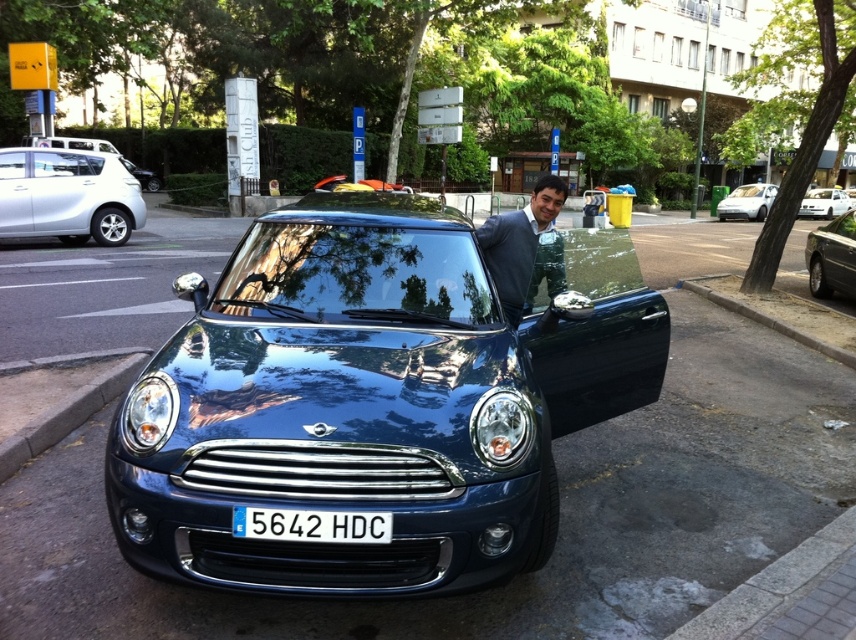
You are a parking attendant who needs to guide a driver to park their car between the metallic silver sedan at right and the metallic silver hatchback at upper left. Can you confirm if there is enough space between them for a standard compact car?

The metallic silver sedan at right is positioned on the right side of the metallic silver hatchback at upper left, so there is space between them. A standard compact car can fit between the metallic silver sedan at right and the metallic silver hatchback at upper left.

You are a delivery person who needs to place a package on the roof of the matte blue suit at center and the white plastic license plate at center. Which object requires the package to be placed higher?

The matte blue suit at center is much taller than the white plastic license plate at center, so the package should be placed higher on the roof of the matte blue suit at center.

You are a delivery person who needs to place a small package on the white plastic license plate at center. However, there is a matte blue suit at center in the way. Can you estimate if the package will fit on the license plate once the suit is moved?

The matte blue suit at center might be wider than white plastic license plate at center, so moving it might not be sufficient. The package may not fit if the suit obstructs the space.